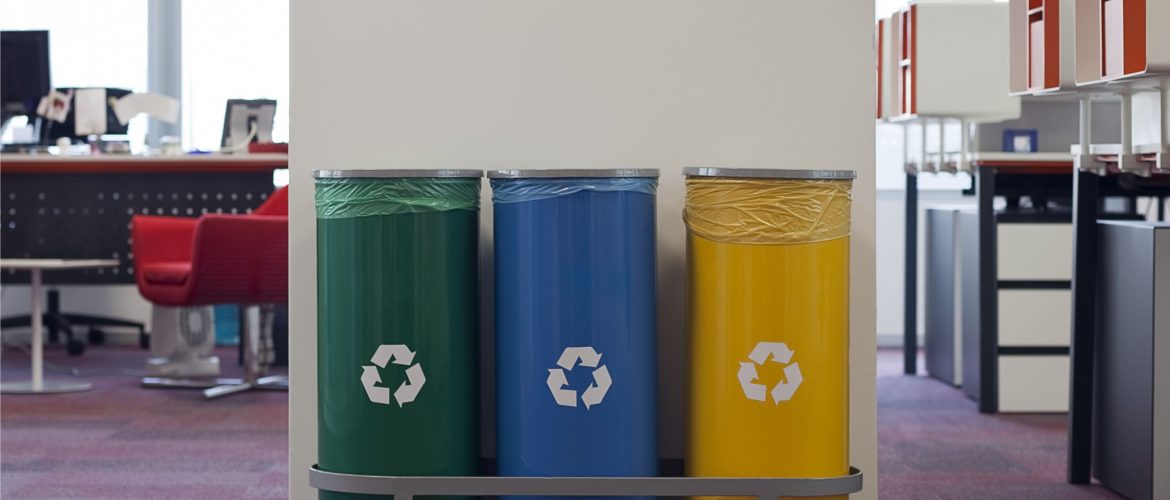
I want to click on red color on edge of desk surface, so click(192, 162).